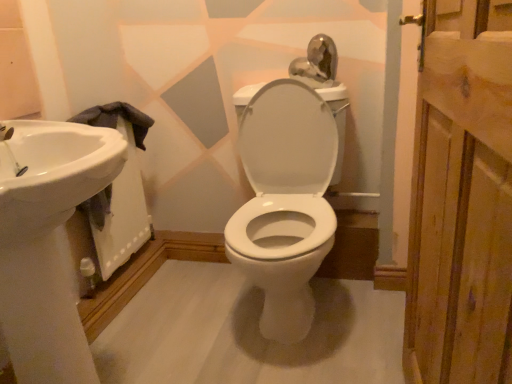
Question: Does white glossy sink at left have a greater width compared to wooden plank at right?

Choices:
 (A) no
 (B) yes

Answer: (A)

Question: From a real-world perspective, is white glossy sink at left located beneath wooden plank at right?

Choices:
 (A) yes
 (B) no

Answer: (A)

Question: Is white glossy sink at left turned away from wooden plank at right?

Choices:
 (A) yes
 (B) no

Answer: (B)

Question: Is white glossy sink at left directly adjacent to wooden plank at right?

Choices:
 (A) yes
 (B) no

Answer: (B)

Question: From the image's perspective, is white glossy sink at left located beneath wooden plank at right?

Choices:
 (A) yes
 (B) no

Answer: (B)

Question: Considering the relative sizes of white glossy sink at left and wooden plank at right in the image provided, is white glossy sink at left thinner than wooden plank at right?

Choices:
 (A) yes
 (B) no

Answer: (A)

Question: Is white glossy sink at left bigger than wooden plank at right?

Choices:
 (A) no
 (B) yes

Answer: (B)

Question: Can you confirm if white glossy sink at left is positioned to the right of wooden plank at right?

Choices:
 (A) no
 (B) yes

Answer: (A)

Question: Does white glossy sink at left have a greater width compared to wooden plank at right?

Choices:
 (A) yes
 (B) no

Answer: (A)

Question: From the image's perspective, is white glossy sink at left beneath wooden plank at right?

Choices:
 (A) no
 (B) yes

Answer: (B)

Question: Is white glossy sink at left not within wooden plank at right?

Choices:
 (A) yes
 (B) no

Answer: (A)

Question: Considering the relative positions of white glossy sink at left and wooden plank at right in the image provided, is white glossy sink at left to the left of wooden plank at right from the viewer's perspective?

Choices:
 (A) no
 (B) yes

Answer: (B)

Question: Are wooden plank at right and white glossy sink at left beside each other?

Choices:
 (A) no
 (B) yes

Answer: (A)